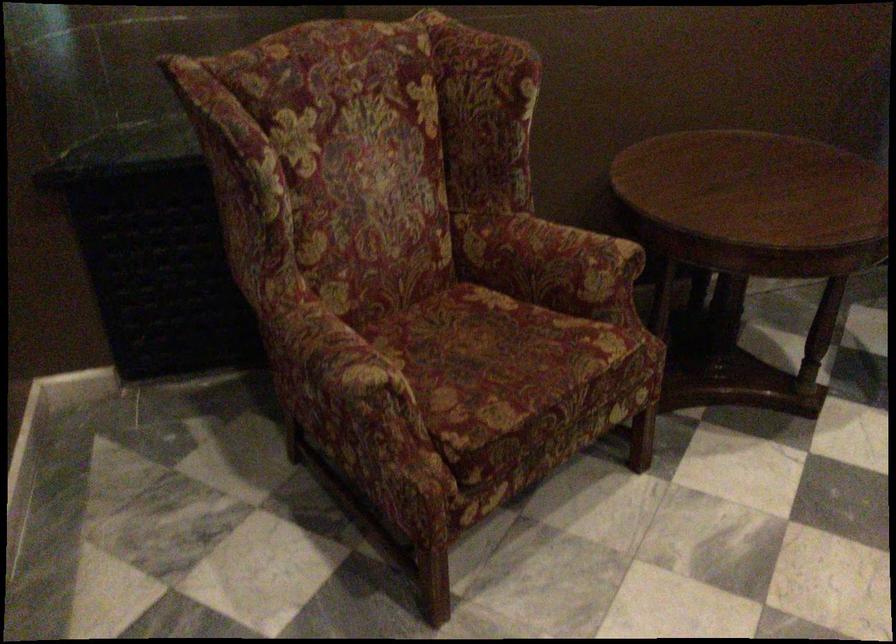
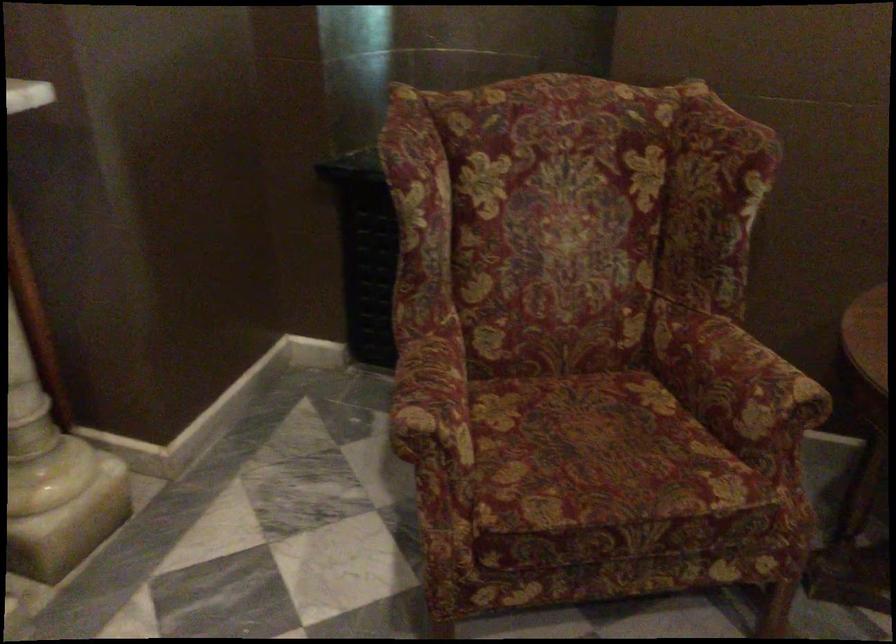
Question: The camera is either moving clockwise (left) or counter-clockwise (right) around the object. The first image is from the beginning of the video and the second image is from the end. Is the camera moving left or right when shooting the video?

Choices:
 (A) Left
 (B) Right

Answer: (B)